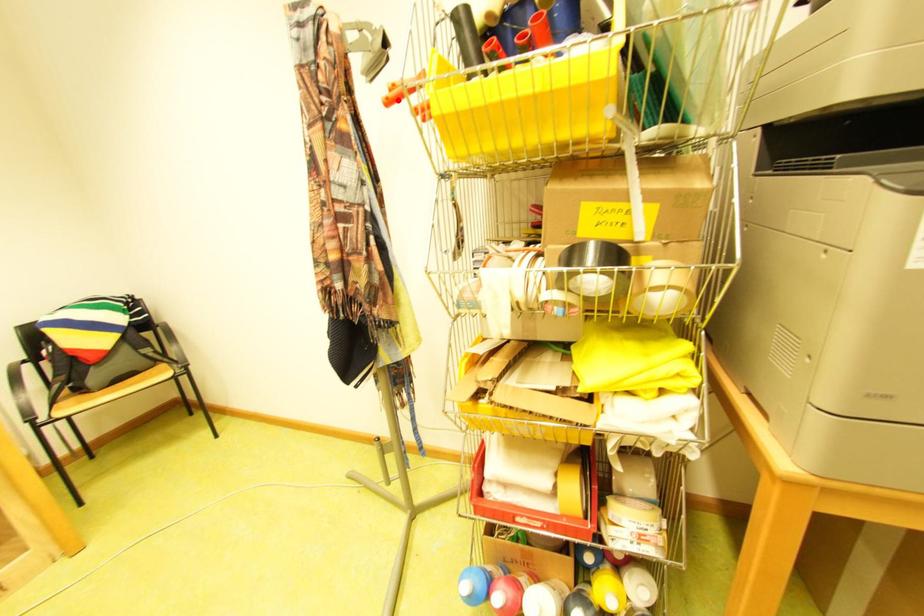
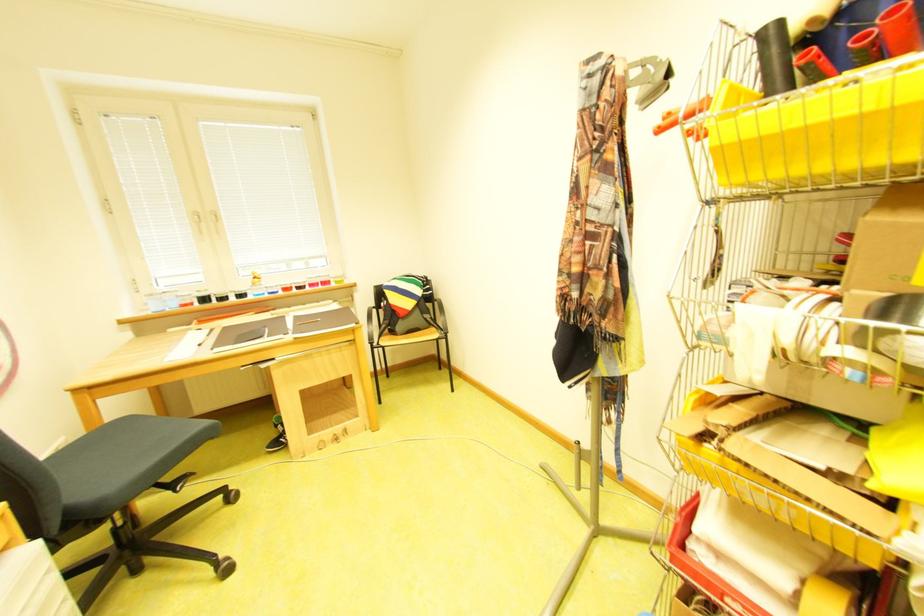
Where in the second image is the point corresponding to the highlighted location from the first image?

(672, 128)